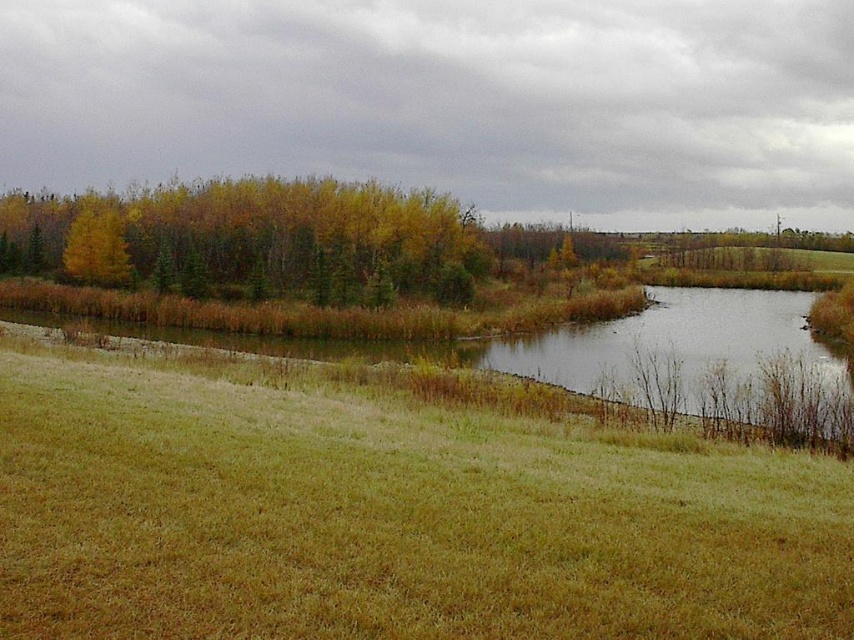
Which is in front, point (809, 604) or point (279, 266)?

Point (809, 604) is in front.

Is point (689, 609) behind point (238, 257)?

No, (689, 609) is in front of (238, 257).

Measure the distance between green matte grass at center and camera.

15.70 feet

This screenshot has width=854, height=640. I want to click on green matte grass at center, so click(390, 520).

Between point (410, 259) and point (71, 260), which one is positioned behind?

The point (71, 260) is more distant.

Who is more distant from viewer, (208, 224) or (86, 276)?

Positioned behind is point (208, 224).

Locate an element on the screen. Image resolution: width=854 pixels, height=640 pixels. yellow-green foliage at upper left is located at coordinates (252, 241).

Who is higher up, green matte grass at center or yellow leafy tree at upper left?

yellow leafy tree at upper left is higher up.

Does green matte grass at center appear over yellow leafy tree at upper left?

No, green matte grass at center is not above yellow leafy tree at upper left.

Which is behind, point (594, 637) or point (79, 236)?

Positioned behind is point (79, 236).

Where is `green matte grass at center`? green matte grass at center is located at coordinates (390, 520).